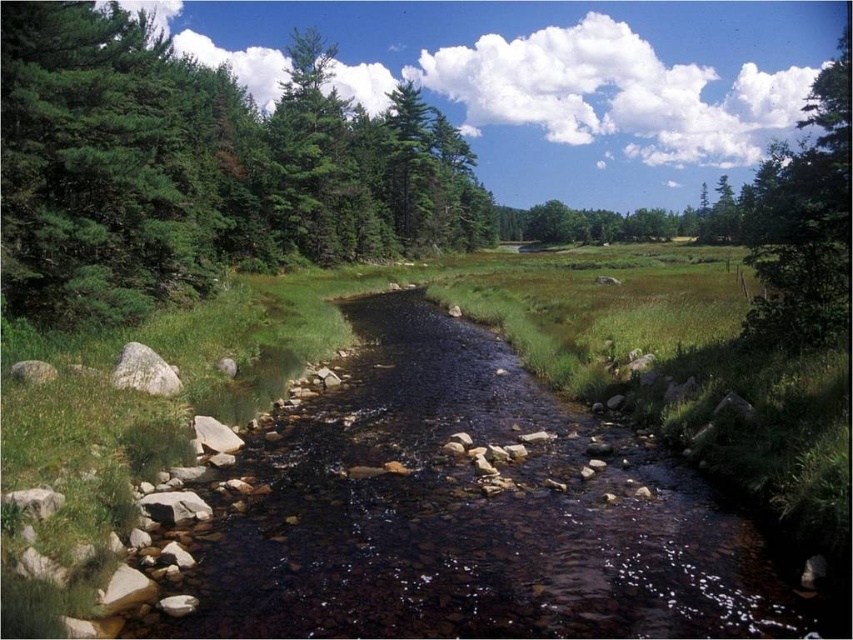
Question: Does green matte tree at left have a larger size compared to gray smooth rock at lower left?

Choices:
 (A) yes
 (B) no

Answer: (A)

Question: Which of these objects is positioned farthest from the green matte tree at upper right?

Choices:
 (A) gray smooth rock at left
 (B) gray smooth rock at lower left

Answer: (B)

Question: Which of the following is the farthest from the observer?

Choices:
 (A) gray smooth rock at lower left
 (B) smooth rock stream at center
 (C) green matte tree at upper right

Answer: (C)

Question: Based on their relative distances, which object is nearer to the smooth rock stream at center?

Choices:
 (A) gray smooth rock at left
 (B) gray smooth rock at lower left
 (C) green matte tree at upper right

Answer: (A)

Question: Is green matte tree at left smaller than gray smooth rock at lower left?

Choices:
 (A) yes
 (B) no

Answer: (B)

Question: Observing the image, what is the correct spatial positioning of gray smooth rock at left in reference to gray smooth rock at lower left?

Choices:
 (A) above
 (B) below

Answer: (B)